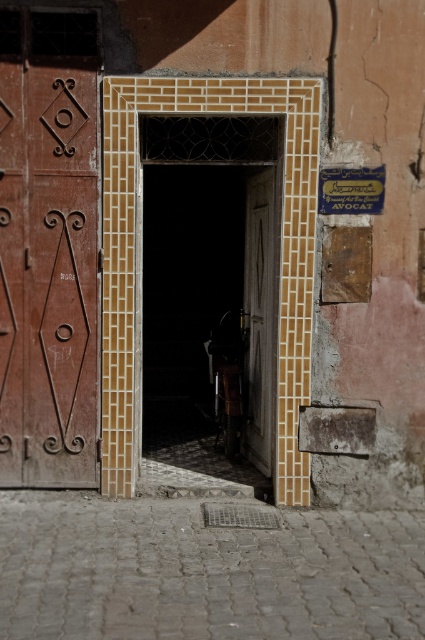
You are a delivery person trying to move a large box through the doorway. The box is 1.2 meters wide. The doorway has two doors, the matte wooden door at center and the wooden carved door at left. Which door should you use to ensure the box fits through?

The matte wooden door at center has a larger width than the wooden carved door at left, so you should use the matte wooden door at center to ensure the box fits through.